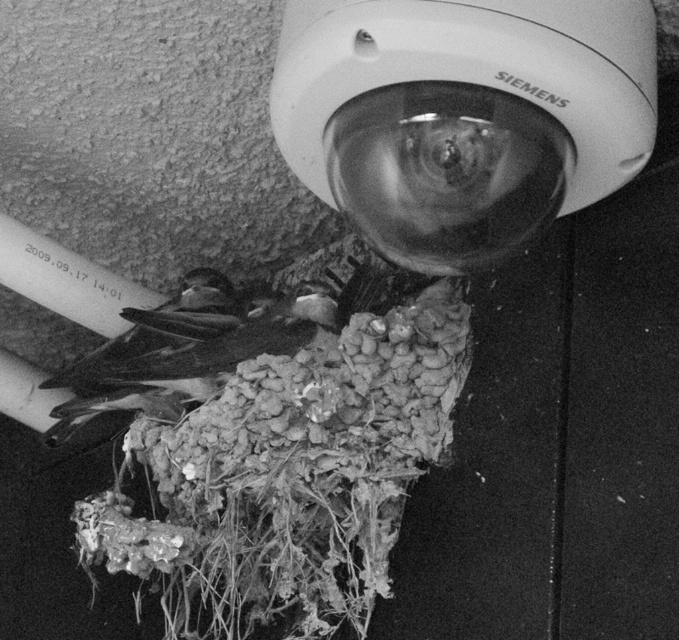
Question: Does fuzzy organic nest at lower center appear on the right side of dark brown feathers at center?

Choices:
 (A) no
 (B) yes

Answer: (B)

Question: Is fuzzy organic nest at lower center positioned at the back of dark brown feathers at center?

Choices:
 (A) no
 (B) yes

Answer: (A)

Question: Does fuzzy organic nest at lower center appear over dark brown feathers at center?

Choices:
 (A) no
 (B) yes

Answer: (A)

Question: Among these objects, which one is nearest to the camera?

Choices:
 (A) fuzzy organic nest at lower center
 (B) dark brown feathers at center

Answer: (A)